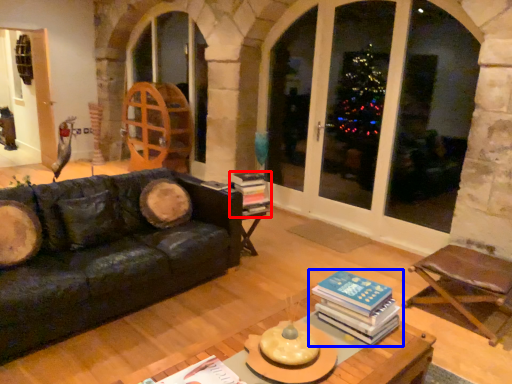
Question: Which point is further to the camera, book (highlighted by a red box) or book (highlighted by a blue box)?

Choices:
 (A) book
 (B) book

Answer: (A)